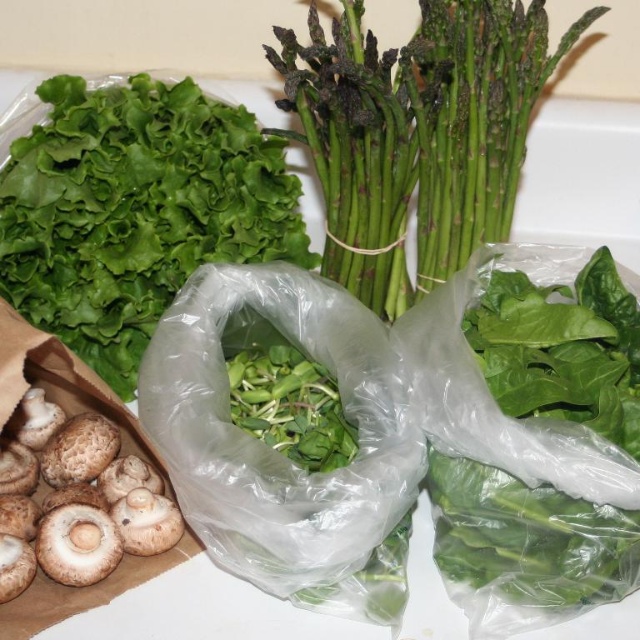
Question: Can you confirm if green leafy lettuce at upper left is smaller than green matte asparagus at center?

Choices:
 (A) yes
 (B) no

Answer: (A)

Question: Does green leafy lettuce at upper left have a lesser width compared to brown textured mushroom at lower left?

Choices:
 (A) yes
 (B) no

Answer: (B)

Question: Which point is farther to the camera?

Choices:
 (A) (38, 193)
 (B) (401, 227)
 (C) (147, 547)

Answer: (B)

Question: Which point is closer to the camera?

Choices:
 (A) brown textured mushroom at lower left
 (B) green leafy lettuce at upper left

Answer: (A)

Question: Does green leafy lettuce at upper left have a larger size compared to brown textured mushroom at lower left?

Choices:
 (A) yes
 (B) no

Answer: (A)

Question: Among these points, which one is farthest from the camera?

Choices:
 (A) (156, 525)
 (B) (400, 80)

Answer: (B)